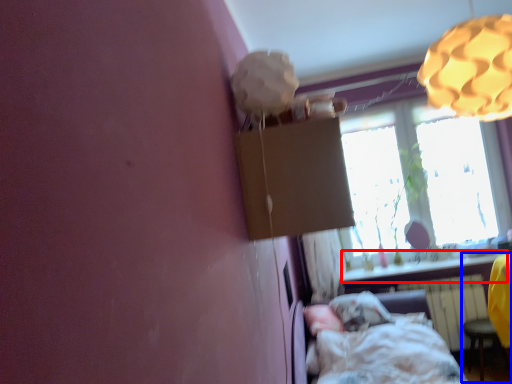
Question: Which object appears closest to the camera in this image, window sill (highlighted by a red box) or swivel chair (highlighted by a blue box)?

Choices:
 (A) window sill
 (B) swivel chair

Answer: (B)